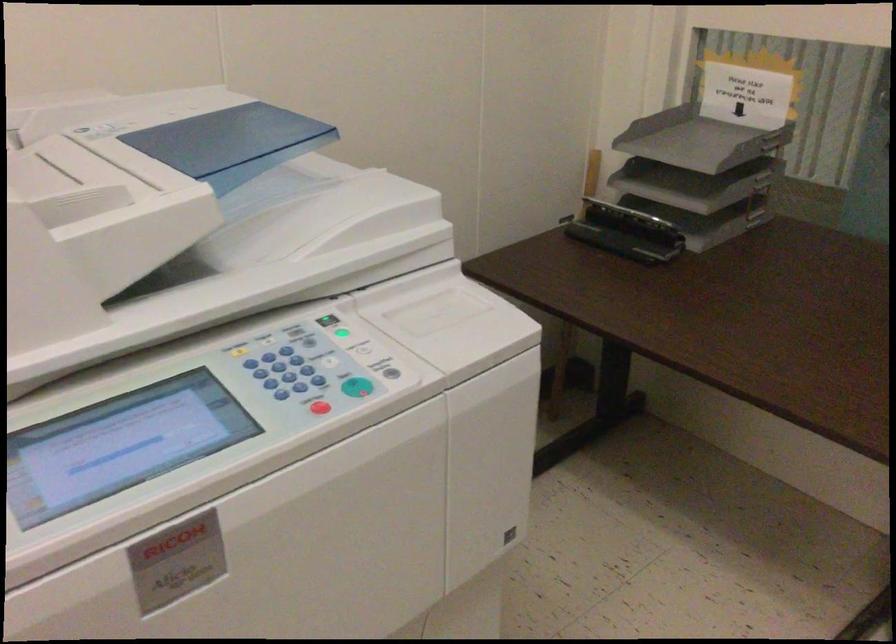
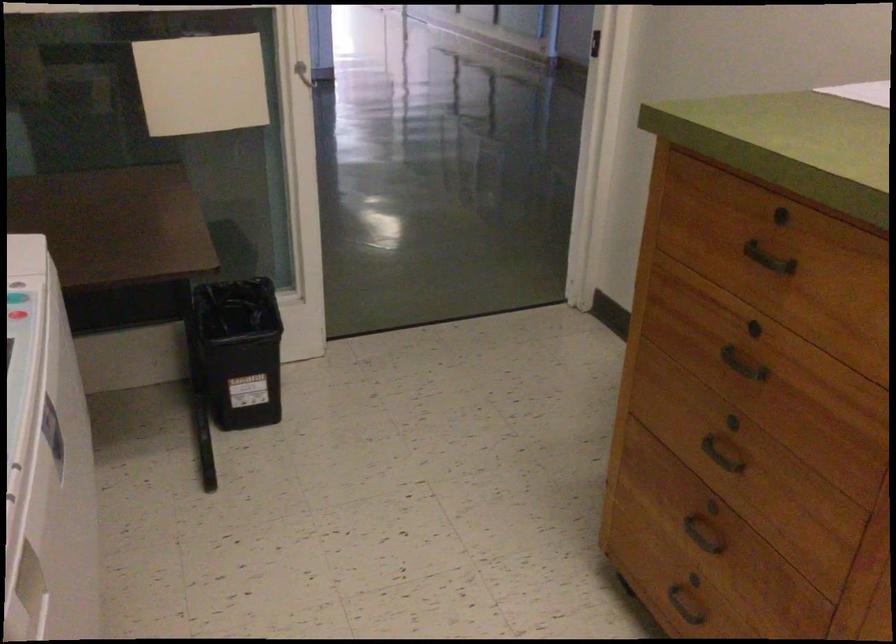
Based on the continuous images, in which direction is the camera rotating?

The camera's rotation is toward right-down.